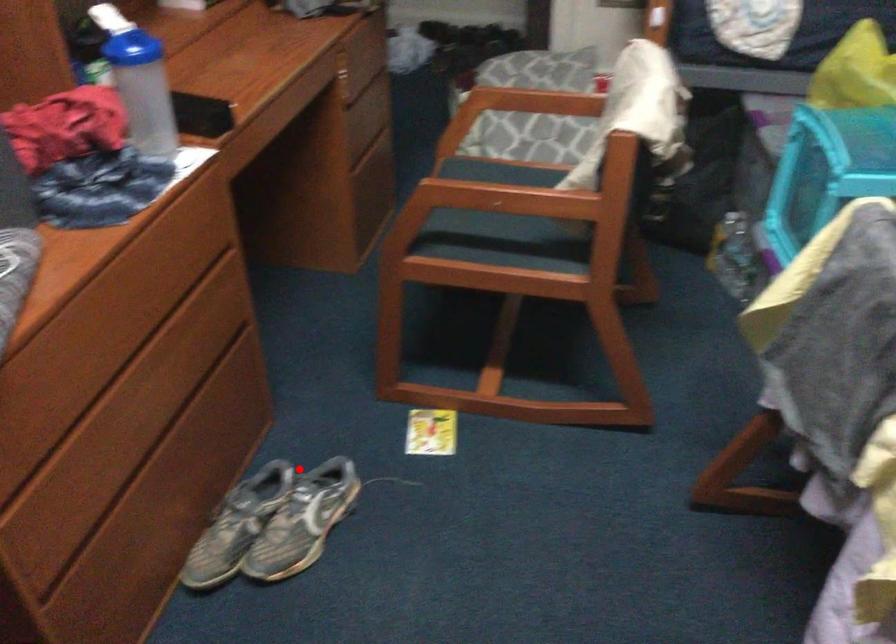
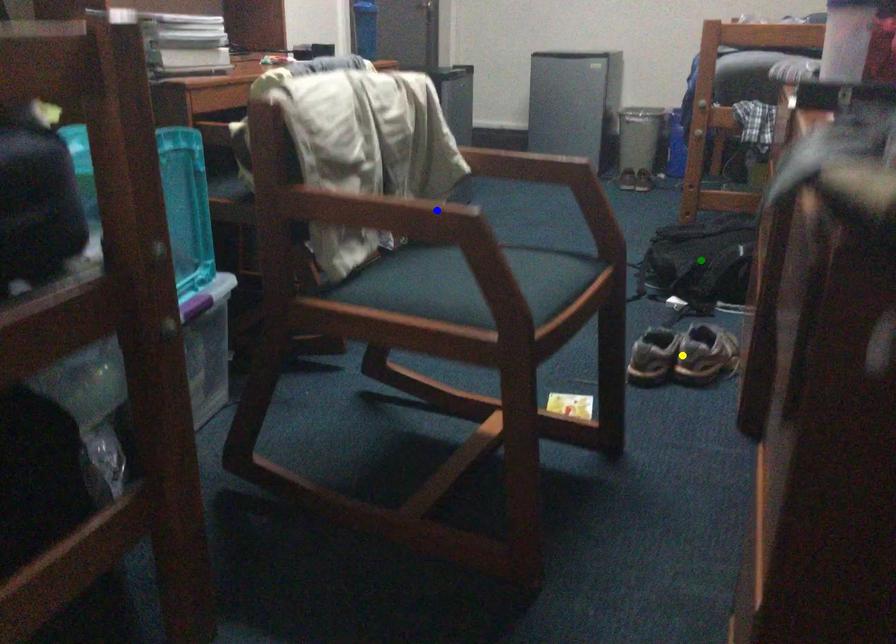
Question: I am providing you with two images of the same scene from different viewpoints. A red point is marked on the first image. You are given multiple points on the second image. Which mark in image 2 goes with the point in image 1?

Choices:
 (A) yellow point
 (B) green point
 (C) blue point

Answer: (A)